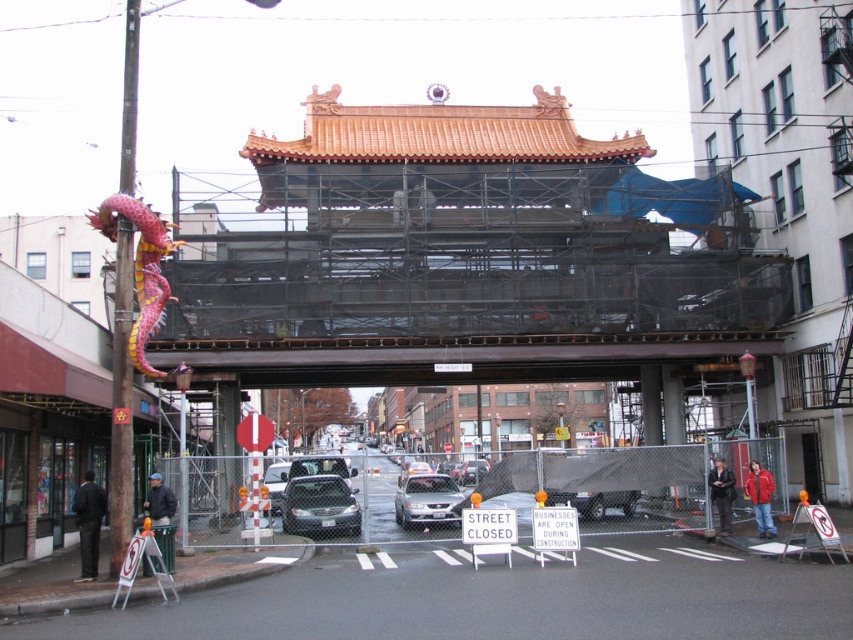
Question: Is matte black sedan at center wider than silver metallic sedan at center?

Choices:
 (A) no
 (B) yes

Answer: (B)

Question: Does matte black sedan at center appear on the left side of silver metallic sedan at center?

Choices:
 (A) no
 (B) yes

Answer: (B)

Question: Which point is farther from the camera taking this photo?

Choices:
 (A) (440, 481)
 (B) (308, 488)

Answer: (A)

Question: Among these points, which one is nearest to the camera?

Choices:
 (A) (303, 528)
 (B) (405, 477)

Answer: (A)

Question: Is matte black sedan at center smaller than silver metallic sedan at center?

Choices:
 (A) yes
 (B) no

Answer: (B)